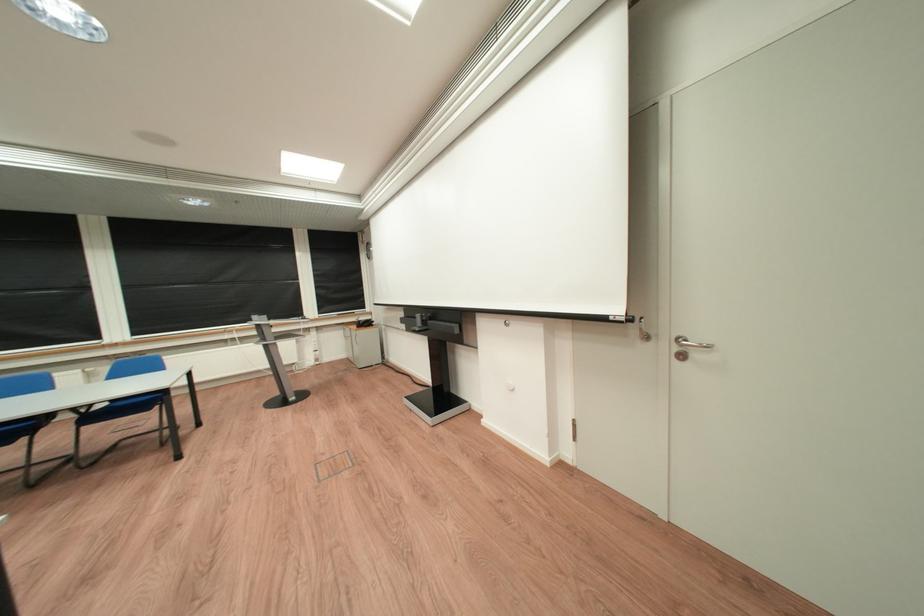
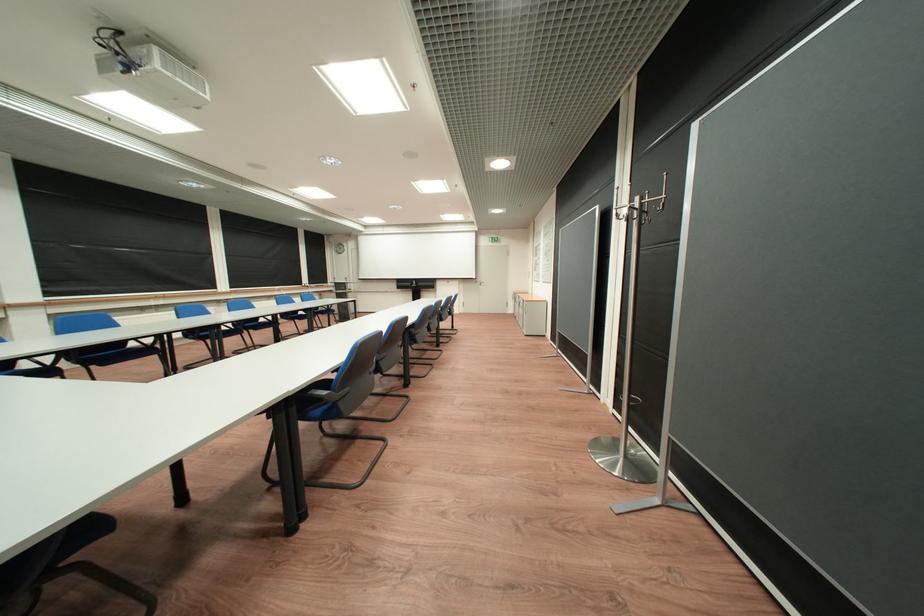
Where in the second image is the point corresponding to [630,312] from the first image?

(487, 278)